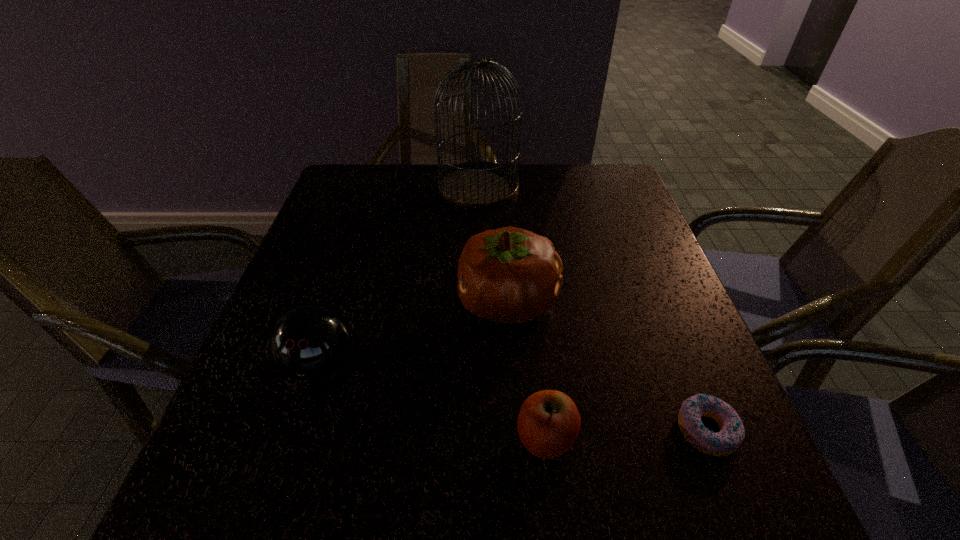
Identify the location of birdcage. (475, 184).

This screenshot has width=960, height=540. Find the location of `the tallest object`. the tallest object is located at coordinates (475, 184).

At what (x,y) coordinates should I click in order to perform the action: click on the fourth shortest object. Please return your answer as a coordinate pair (x, y). Image resolution: width=960 pixels, height=540 pixels. Looking at the image, I should click on (509, 275).

Locate an element on the screen. the leftmost object is located at coordinates (309, 342).

You are a GUI agent. You are given a task and a screenshot of the screen. Output one action in this format:
    pyautogui.click(x=<x>, y=<y>)
    Task: Click on the third tallest object
    
    Given the screenshot: What is the action you would take?
    pyautogui.click(x=309, y=342)

At what (x,y) coordinates should I click in order to perform the action: click on apple. Please return your answer as a coordinate pair (x, y). Looking at the image, I should click on (548, 424).

In order to click on doughnut in this screenshot , I will do `click(729, 438)`.

At what (x,y) coordinates should I click in order to perform the action: click on the rightmost object. Please return your answer as a coordinate pair (x, y). This screenshot has height=540, width=960. Looking at the image, I should click on (729, 438).

Locate an element on the screen. free space located on the front of the farthest object is located at coordinates (478, 268).

Locate an element on the screen. The image size is (960, 540). vacant area situated on the side of the second tallest object with the cute face is located at coordinates (430, 301).